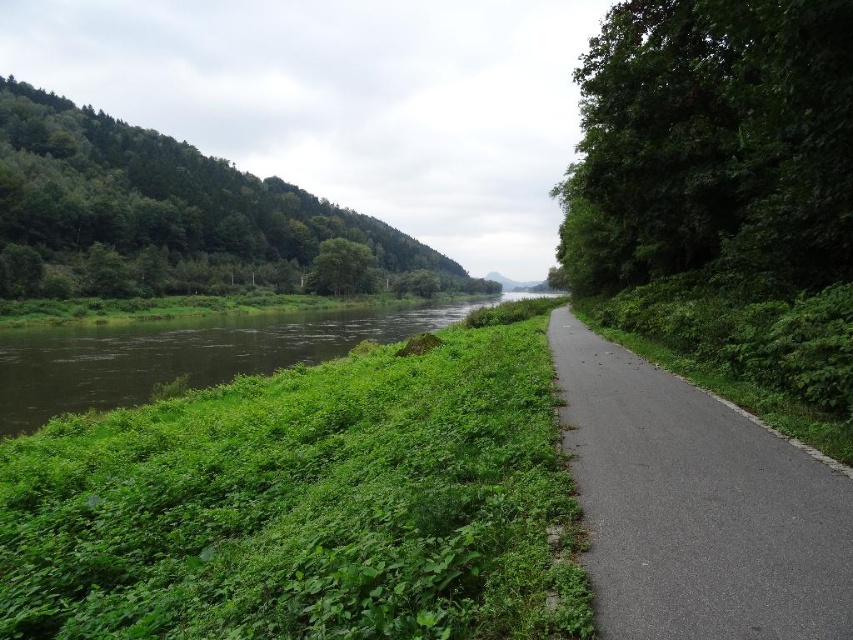
You are standing on the paved path and want to cross to the other side of the green grassy river at center. The green leafy tree at center is blocking your view. Can you see the opposite riverbank clearly?

The green grassy river at center is below the green leafy tree at center, so the tree is positioned above the river in the image. This means the tree is likely between you and the river, potentially blocking your view of the opposite riverbank.

You are a hiker walking along the black asphalt path at right and notice the green leafy tree at center. From your perspective, does the tree appear to be above or below the path?

The black asphalt path at right is positioned under the green leafy tree at center, so the tree appears to be above the path from the hiker perspective.